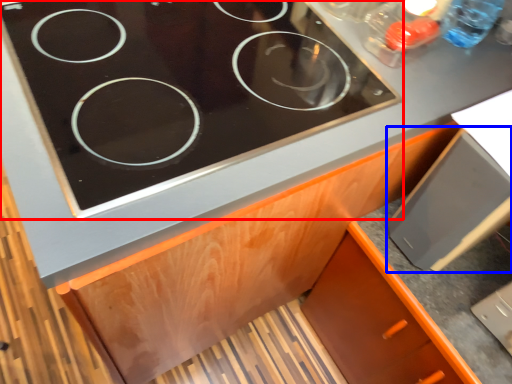
Question: Which of the following is the farthest to the observer, gas stove (highlighted by a red box) or appliance (highlighted by a blue box)?

Choices:
 (A) gas stove
 (B) appliance

Answer: (B)